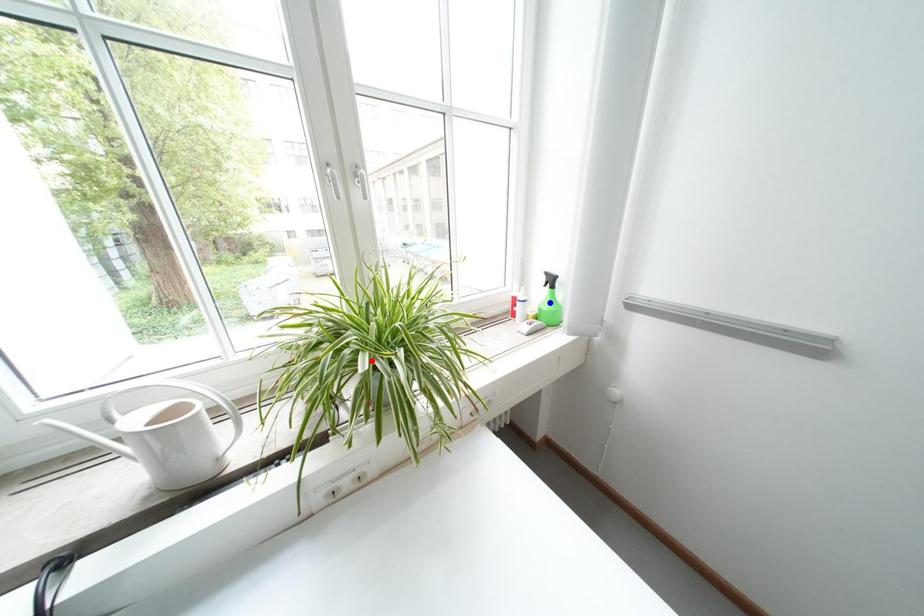
Question: In the image, two points are highlighted. Which point is nearer to the camera? Reply with the corresponding letter.

Choices:
 (A) blue point
 (B) red point

Answer: (B)